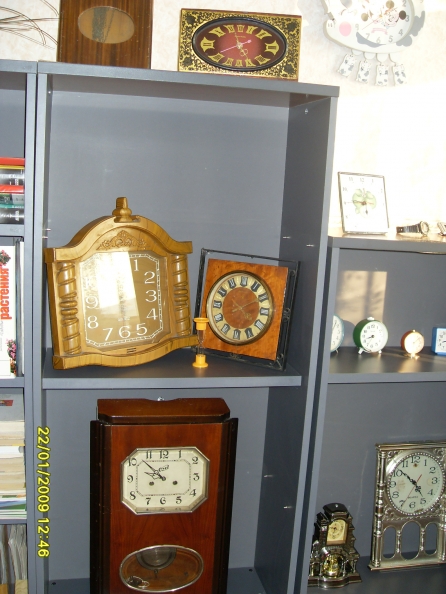
This screenshot has width=446, height=594. In order to click on wood cases in this screenshot , I will do `click(136, 58)`, `click(273, 280)`, `click(149, 236)`, `click(172, 434)`.